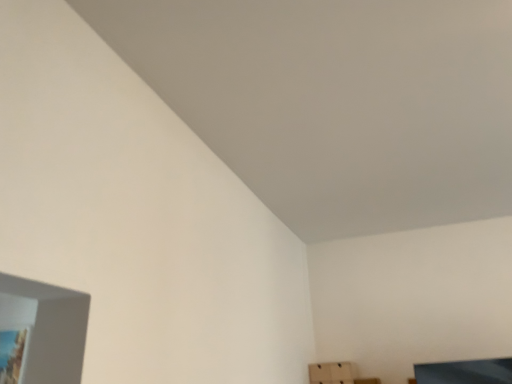
Question: Should I look upward or downward to see white cardboard box at lower right?

Choices:
 (A) up
 (B) down

Answer: (B)